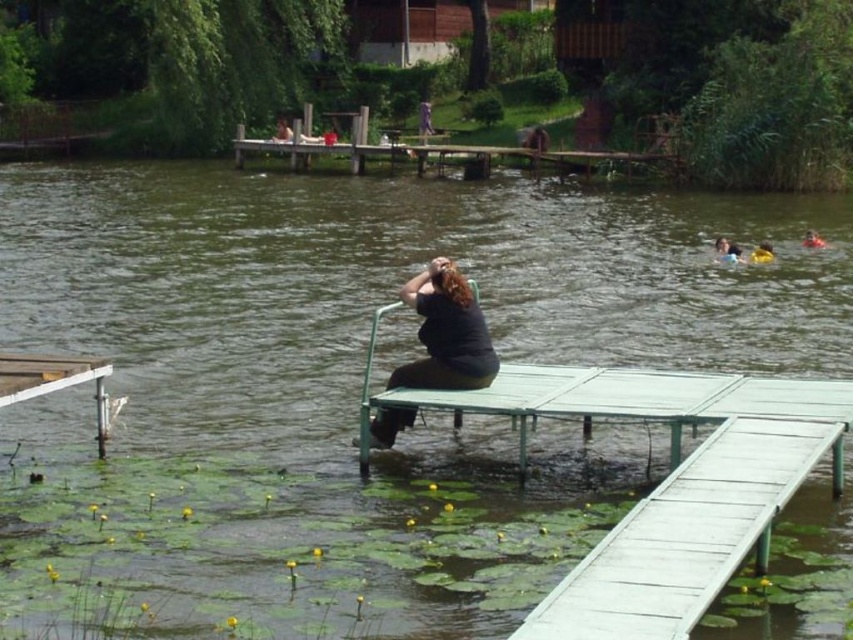
Question: Does yellow fabric person at upper right appear under orange life vest at upper right?

Choices:
 (A) yes
 (B) no

Answer: (A)

Question: Does black matte bench at center have a larger size compared to white metal dock at lower left?

Choices:
 (A) no
 (B) yes

Answer: (A)

Question: Is the position of white metal dock at lower left less distant than that of smooth skin face at upper right?

Choices:
 (A) yes
 (B) no

Answer: (A)

Question: Estimate the real-world distances between objects in this image. Which object is farther from the white metal dock at lower left?

Choices:
 (A) orange life vest at upper right
 (B) black matte bench at center
 (C) yellow fabric person at upper right

Answer: (A)

Question: Which point is closer to the camera taking this photo?

Choices:
 (A) (28, 372)
 (B) (762, 244)

Answer: (A)

Question: Which of the following is the farthest from the observer?

Choices:
 (A) (763, 257)
 (B) (717, 243)

Answer: (B)